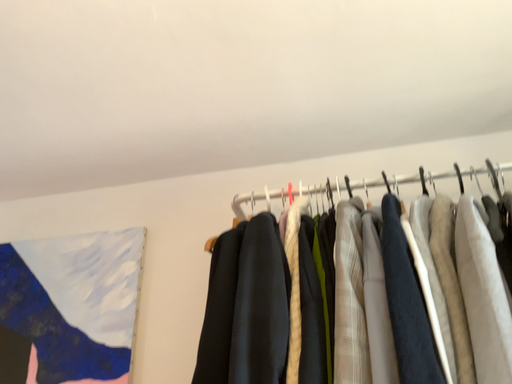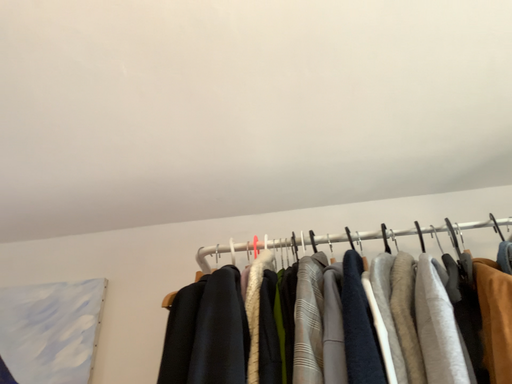
Question: Which way did the camera rotate in the video?

Choices:
 (A) rotated upward
 (B) rotated downward

Answer: (A)